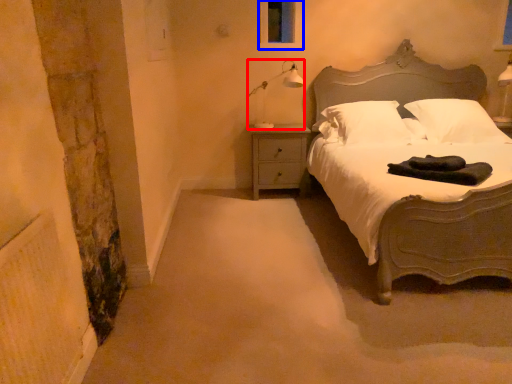
Question: Among these objects, which one is farthest to the camera, lamp (highlighted by a red box) or window screen (highlighted by a blue box)?

Choices:
 (A) lamp
 (B) window screen

Answer: (B)